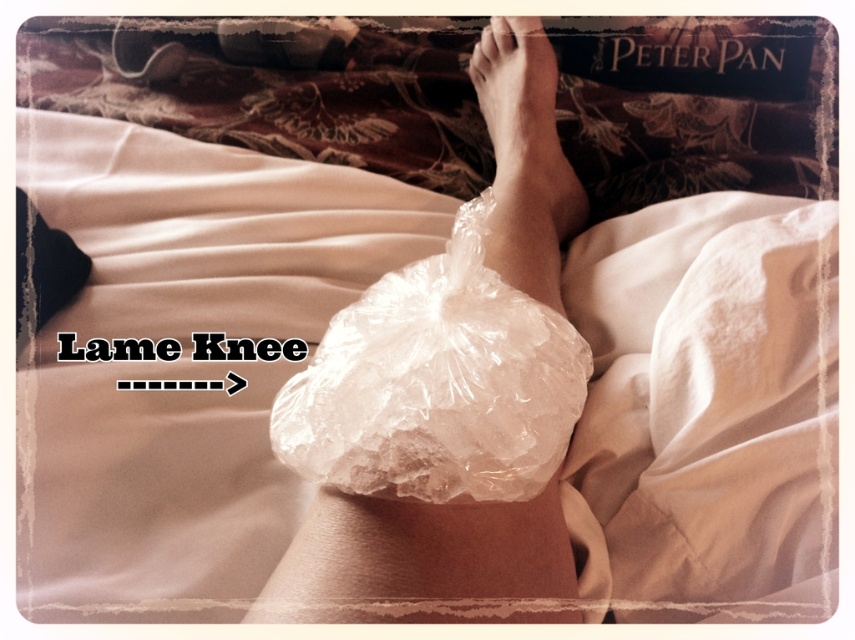
Is point (469, 621) positioned in front of point (575, 211)?

Yes, it is in front of point (575, 211).

Who is more forward, (464, 516) or (529, 65)?

Point (464, 516)

Between point (543, 532) and point (555, 68), which one is positioned in front?

Positioned in front is point (543, 532).

Image resolution: width=855 pixels, height=640 pixels. What are the coordinates of `clear plastic ice pack at center` in the screenshot? It's located at (422, 563).

Does translucent plastic bag at center have a lesser height compared to smooth skin foot at upper center?

Correct, translucent plastic bag at center is not as tall as smooth skin foot at upper center.

Who is more distant from viewer, (x=391, y=358) or (x=540, y=134)?

The point (x=540, y=134) is behind.

The width and height of the screenshot is (855, 640). I want to click on translucent plastic bag at center, so click(437, 385).

Which is more to the right, translucent plastic bag at center or clear plastic ice pack at center?

From the viewer's perspective, clear plastic ice pack at center appears more on the right side.

Does translucent plastic bag at center have a lesser width compared to clear plastic ice pack at center?

Indeed, translucent plastic bag at center has a lesser width compared to clear plastic ice pack at center.

What are the coordinates of `translucent plastic bag at center` in the screenshot? It's located at pos(437,385).